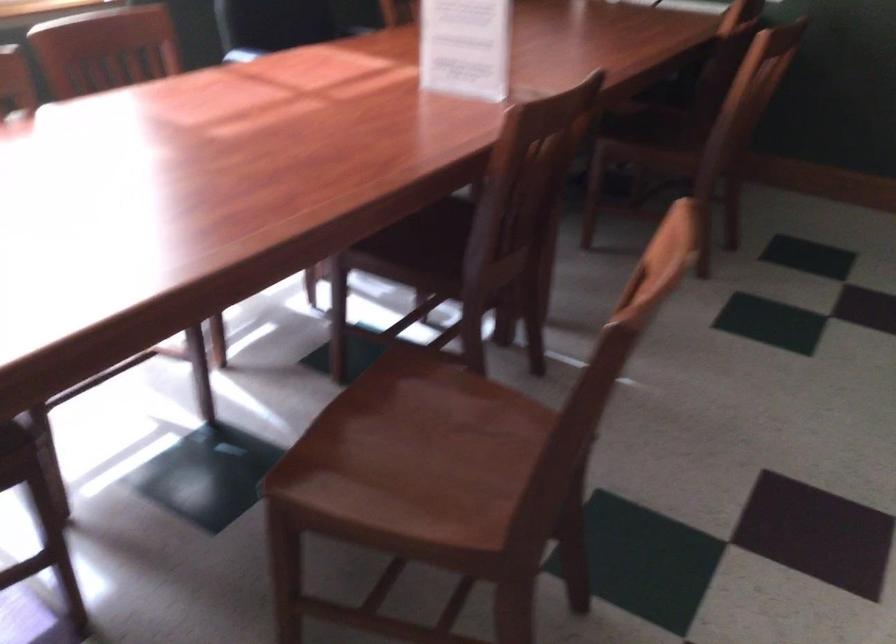
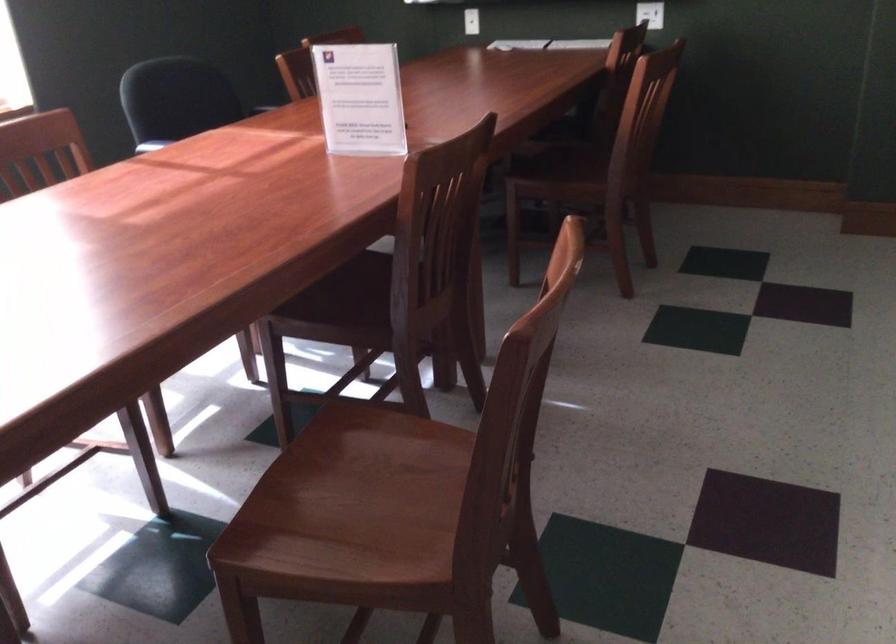
The point at (407, 455) is marked in the first image. Where is the corresponding point in the second image?

(351, 504)